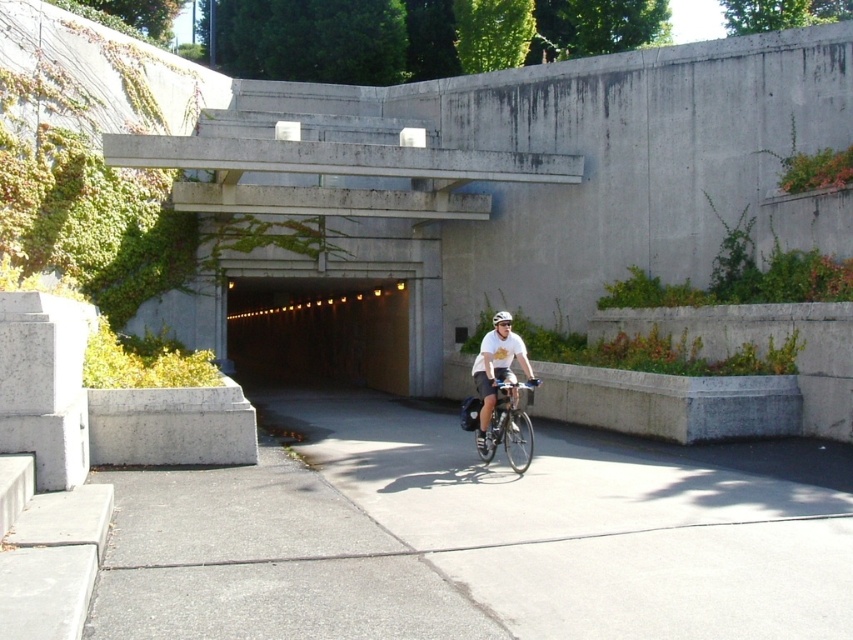
Question: Does white matte shirt at center have a smaller size compared to white matte bicycle helmet at center?

Choices:
 (A) yes
 (B) no

Answer: (A)

Question: Which object appears closest to the camera in this image?

Choices:
 (A) silver metallic bicycle at center
 (B) white matte bicycle helmet at center

Answer: (A)

Question: Considering the relative positions of silver metallic bicycle at center and white matte bicycle helmet at center in the image provided, where is silver metallic bicycle at center located with respect to white matte bicycle helmet at center?

Choices:
 (A) left
 (B) right

Answer: (A)

Question: Does silver metallic bicycle at center appear on the left side of white matte shirt at center?

Choices:
 (A) no
 (B) yes

Answer: (A)

Question: Considering the real-world distances, which object is closest to the white matte bicycle helmet at center?

Choices:
 (A) silver metallic bicycle at center
 (B) white matte shirt at center

Answer: (A)

Question: Which point is closer to the camera?

Choices:
 (A) white matte bicycle helmet at center
 (B) silver metallic bicycle at center

Answer: (B)